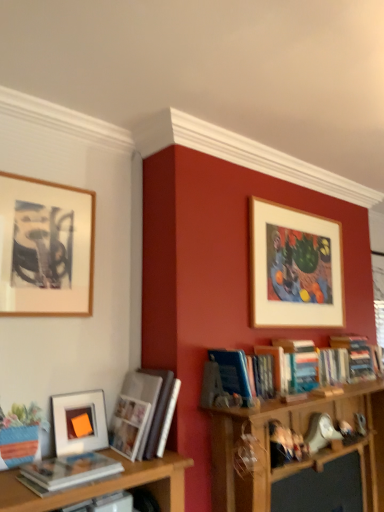
Question: Considering the positions of hardcover books at upper right, the first book when ordered from right to left, and white glossy photo album at left, placed as the 2th book when sorted from left to right, in the image, is hardcover books at upper right, the first book when ordered from right to left, taller or shorter than white glossy photo album at left, placed as the 2th book when sorted from left to right,?

Choices:
 (A) tall
 (B) short

Answer: (B)

Question: Looking at their shapes, would you say hardcover books at upper right, the first book when ordered from right to left, is wider or thinner than white glossy photo album at left, placed as the 2th book when sorted from left to right?

Choices:
 (A) thin
 (B) wide

Answer: (A)

Question: Estimate the real-world distances between objects in this image. Which object is closer to the matte white book at lower left, which ranks as the fifth book in right-to-left order?

Choices:
 (A) hardcover book at upper right, arranged as the second book when viewed from the right
 (B) blue hardcover book at center-right, the 3th book in the left-to-right sequence
 (C) hardcover books at upper right, which ranks as the 5th book in left-to-right order
 (D) wooden picture frame at upper right, which is the 3th picture frame from front to back
 (E) matte white picture frame at left, the second picture frame in the back-to-front sequence

Answer: (E)

Question: Based on their relative distances, which object is farther from the blue hardcover book at center-right, which is counted as the third book, starting from the right?

Choices:
 (A) hardcover book at upper right, which is the 4th book from left to right
 (B) wooden picture frame at upper right, which is the 3th picture frame from front to back
 (C) wooden framed artwork at upper left, the first picture frame positioned from the left
 (D) matte white picture frame at left, the 2th picture frame from the left
 (E) matte white book at lower left, which ranks as the fifth book in right-to-left order

Answer: (E)